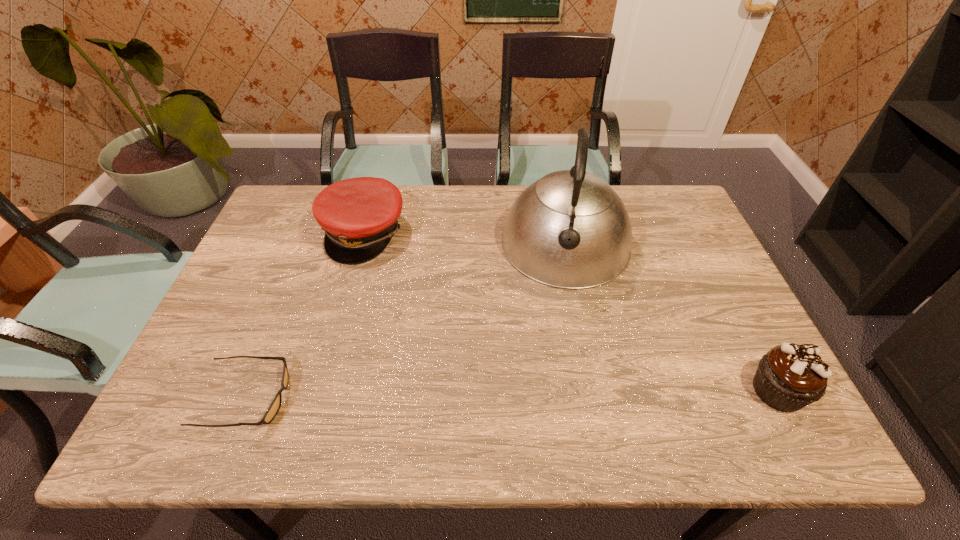
Image resolution: width=960 pixels, height=540 pixels. In order to click on free space on the desktop that is between the shortest object and the rightmost object and is positioned from the spout of the third object from left to right in this screenshot , I will do pos(550,394).

At what (x,y) coordinates should I click in order to perform the action: click on vacant spot on the desktop that is between the sunglasses and the rightmost object and is positioned at the front of the cap where the visor is located. Please return your answer as a coordinate pair (x, y). This screenshot has width=960, height=540. Looking at the image, I should click on (509, 394).